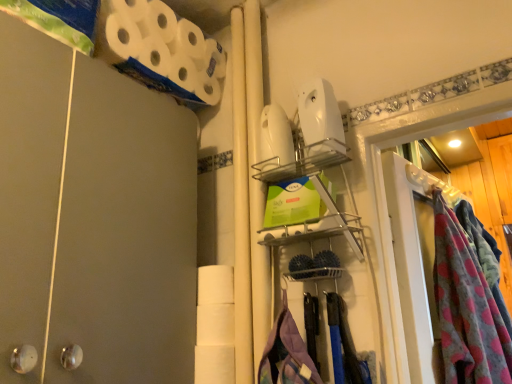
Question: Is point (230, 340) closer or farther from the camera than point (197, 51)?

Choices:
 (A) farther
 (B) closer

Answer: (B)

Question: Looking at their shapes, would you say white matte toilet paper at center, the second toilet paper when ordered from top to bottom, is wider or thinner than white matte toilet paper at upper left, marked as the 1th toilet paper in a top-to-bottom arrangement?

Choices:
 (A) wide
 (B) thin

Answer: (B)

Question: Which of these objects is positioned closest to the white matte toilet paper at upper left, placed as the 2th toilet paper when sorted from bottom to top?

Choices:
 (A) clear plastic glass door at right
 (B) fluffy pink blanket at right
 (C) matte gray barn door at left
 (D) white matte toilet paper at center, marked as the 1th toilet paper in a bottom-to-top arrangement

Answer: (C)

Question: Which object is the closest to the white matte toilet paper at upper left, placed as the 2th toilet paper when sorted from bottom to top?

Choices:
 (A) matte gray barn door at left
 (B) fluffy pink blanket at right
 (C) white matte toilet paper at center, marked as the 1th toilet paper in a bottom-to-top arrangement
 (D) clear plastic glass door at right

Answer: (A)